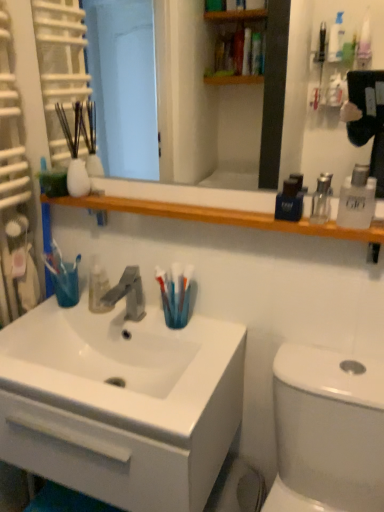
Question: From the image's perspective, is wooden shelf at upper center over white glossy cabinet at lower left?

Choices:
 (A) no
 (B) yes

Answer: (B)

Question: Is wooden shelf at upper center positioned before white glossy cabinet at lower left?

Choices:
 (A) no
 (B) yes

Answer: (B)

Question: Could you tell me if wooden shelf at upper center is turned towards white glossy cabinet at lower left?

Choices:
 (A) no
 (B) yes

Answer: (A)

Question: Is wooden shelf at upper center facing away from white glossy cabinet at lower left?

Choices:
 (A) yes
 (B) no

Answer: (B)

Question: Can you confirm if wooden shelf at upper center is bigger than white glossy cabinet at lower left?

Choices:
 (A) no
 (B) yes

Answer: (A)

Question: From a real-world perspective, is wooden shelf at upper center located higher than white glossy cabinet at lower left?

Choices:
 (A) no
 (B) yes

Answer: (B)

Question: Is the position of clear glass mouthwash at upper right, the second mouthwash positioned from the right, less distant than that of blue plastic toothbrush at sink?

Choices:
 (A) yes
 (B) no

Answer: (A)

Question: Can you confirm if clear glass mouthwash at upper right, placed as the 2th mouthwash when sorted from left to right, is positioned to the left of blue plastic toothbrush at sink?

Choices:
 (A) yes
 (B) no

Answer: (B)

Question: Considering the relative sizes of clear glass mouthwash at upper right, placed as the 2th mouthwash when sorted from left to right, and blue plastic toothbrush at sink in the image provided, is clear glass mouthwash at upper right, placed as the 2th mouthwash when sorted from left to right, wider than blue plastic toothbrush at sink?

Choices:
 (A) yes
 (B) no

Answer: (B)

Question: Considering the relative positions of clear glass mouthwash at upper right, placed as the 2th mouthwash when sorted from left to right, and blue plastic toothbrush at sink in the image provided, is clear glass mouthwash at upper right, placed as the 2th mouthwash when sorted from left to right, behind blue plastic toothbrush at sink?

Choices:
 (A) no
 (B) yes

Answer: (A)

Question: Can you see clear glass mouthwash at upper right, the second mouthwash positioned from the right, touching blue plastic toothbrush at sink?

Choices:
 (A) yes
 (B) no

Answer: (B)

Question: From the image's perspective, is clear glass mouthwash at upper right, placed as the 2th mouthwash when sorted from left to right, above blue plastic toothbrush at sink?

Choices:
 (A) yes
 (B) no

Answer: (A)

Question: Can you confirm if clear glass mouthwash at upper right, the second mouthwash positioned from the right, is taller than clear plastic bottle at right, marked as the third mouthwash in a left-to-right arrangement?

Choices:
 (A) no
 (B) yes

Answer: (A)